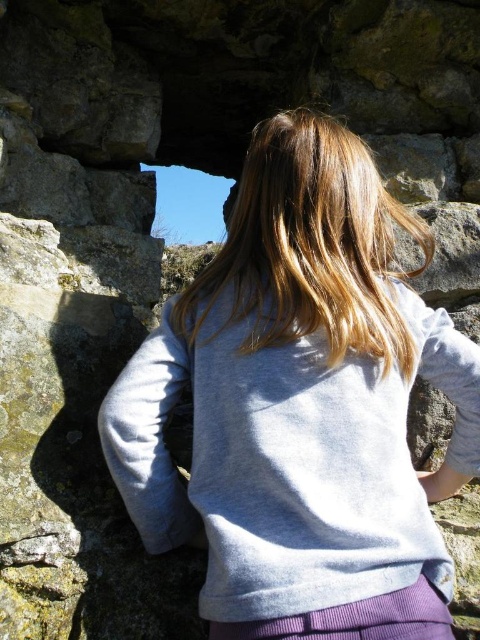
Can you confirm if light gray fleece at center is thinner than blonde silky hair at center?

No.

Can you confirm if light gray fleece at center is positioned to the left of blonde silky hair at center?

Indeed, light gray fleece at center is positioned on the left side of blonde silky hair at center.

Locate an element on the screen. The image size is (480, 640). light gray fleece at center is located at coordinates (301, 406).